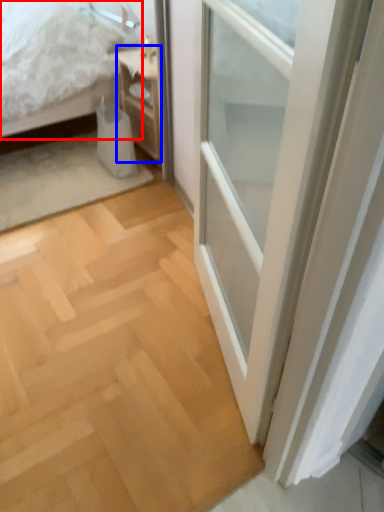
Question: Which object appears farthest to the camera in this image, bed (highlighted by a red box) or nightstand (highlighted by a blue box)?

Choices:
 (A) bed
 (B) nightstand

Answer: (B)